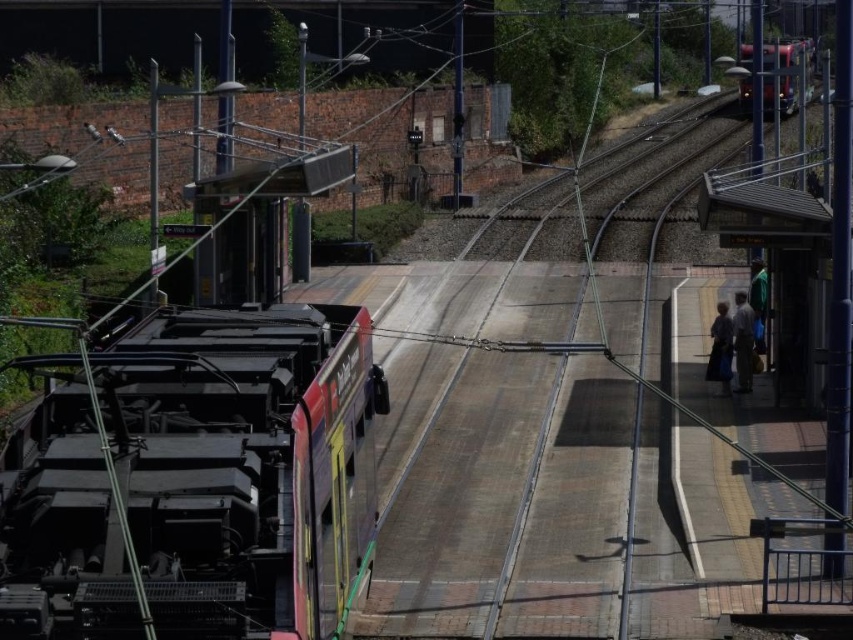
You are a passenger waiting at the tram station. You see two metallic red trains. One is the metallic red train at left and the other is the metallic red train at upper right. Which one is closer to you?

The metallic red train at left is closer to you because it is in front of the metallic red train at upper right.

You are standing at the tram station and want to walk from point A to point B. Point A is at coordinate point (743, 388) and point B is at coordinate point (728, 314). Based on the scene description, which direction should you move to reach point B from point A?

To reach point B from point A, you should move backward since point A is in front of point B according to their coordinates.

You are a passenger waiting at the tram station. You notice a metallic red train at left and a light brown fabric coat at right. Which object is taller?

The metallic red train at left is taller than the light brown fabric coat at right.